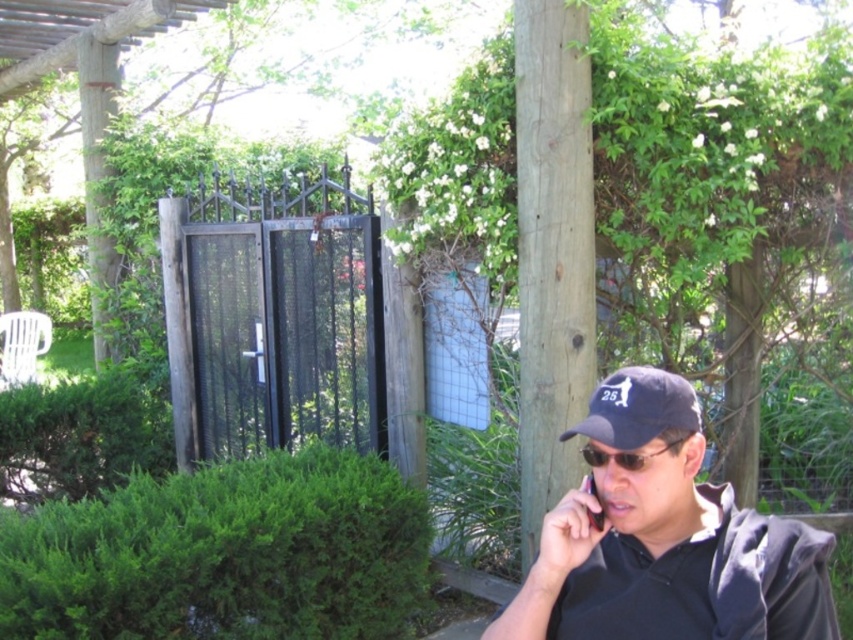
Based on the photo, who is lower down, matte black cap at center or sunglasses at center?

Positioned lower is matte black cap at center.

Measure the distance between matte black cap at center and camera.

matte black cap at center is 1.26 meters away from camera.

Looking at this image, who is more forward, [625,600] or [599,465]?

Point [599,465] is more forward.

At what (x,y) coordinates should I click in order to perform the action: click on matte black cap at center. Please return your answer as a coordinate pair (x, y). The width and height of the screenshot is (853, 640). Looking at the image, I should click on (665, 540).

Does navy blue fabric baseball cap at upper right appear under sunglasses at center?

No.

Between point (695, 426) and point (666, 445), which one is positioned in front?

Positioned in front is point (666, 445).

At what (x,y) coordinates should I click in order to perform the action: click on navy blue fabric baseball cap at upper right. Please return your answer as a coordinate pair (x, y). The width and height of the screenshot is (853, 640). Looking at the image, I should click on (637, 408).

Based on the photo, does green leafy hedge at lower left lie behind sunglasses at center?

That is True.

Which of these two, green leafy hedge at lower left or sunglasses at center, stands taller?

With more height is green leafy hedge at lower left.

Is point (4, 570) positioned before point (672, 445)?

No, it is behind (672, 445).

What are the coordinates of `green leafy hedge at lower left` in the screenshot? It's located at (225, 556).